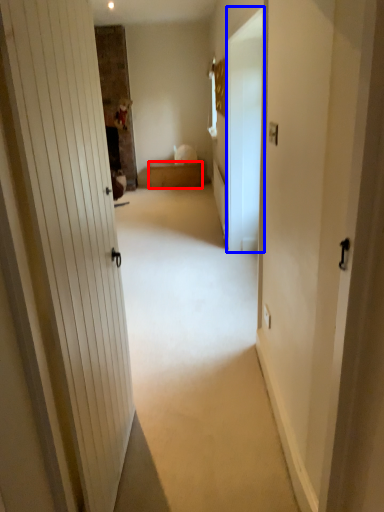
Question: Which of the following is the farthest to the observer, furniture (highlighted by a red box) or screen door (highlighted by a blue box)?

Choices:
 (A) furniture
 (B) screen door

Answer: (A)